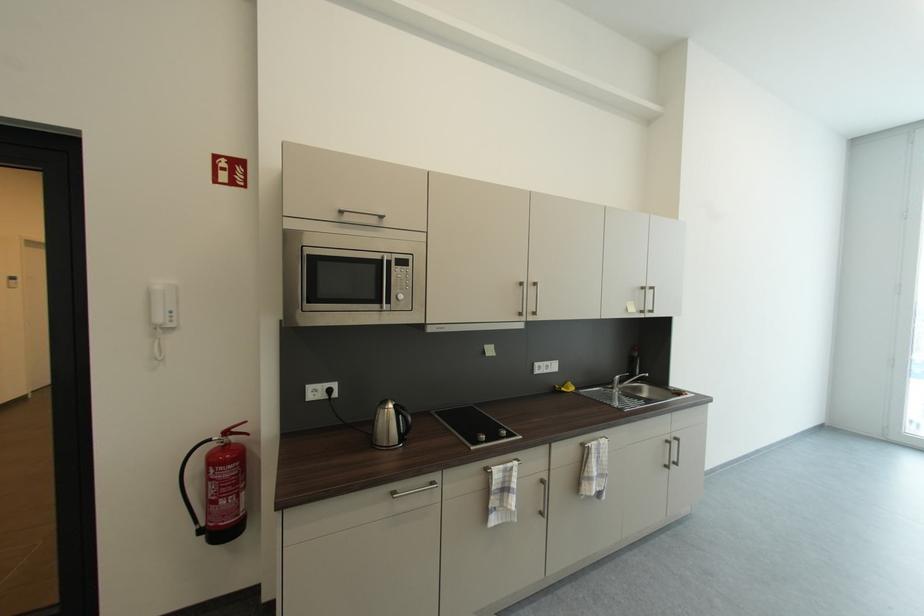
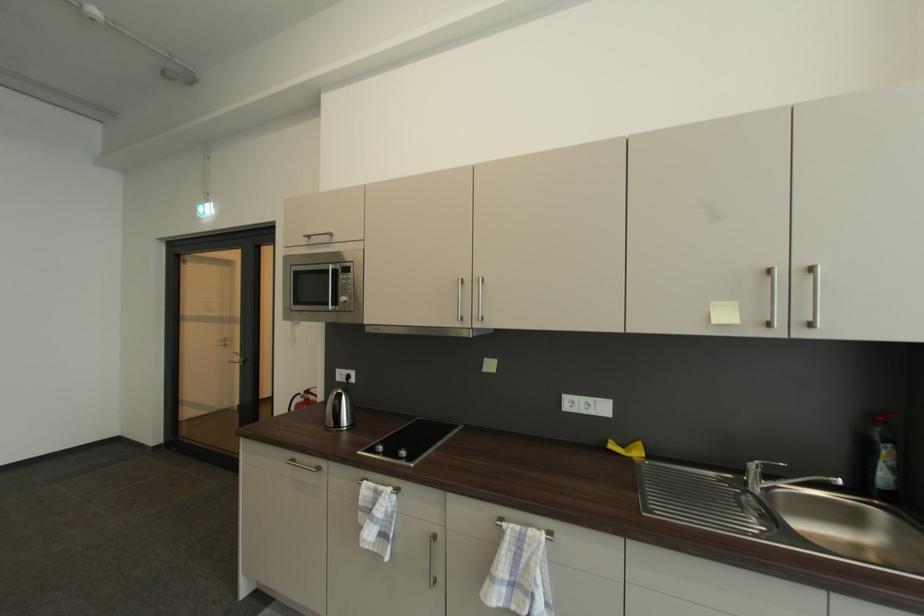
The point at (400, 499) is marked in the first image. Where is the corresponding point in the second image?

(295, 464)